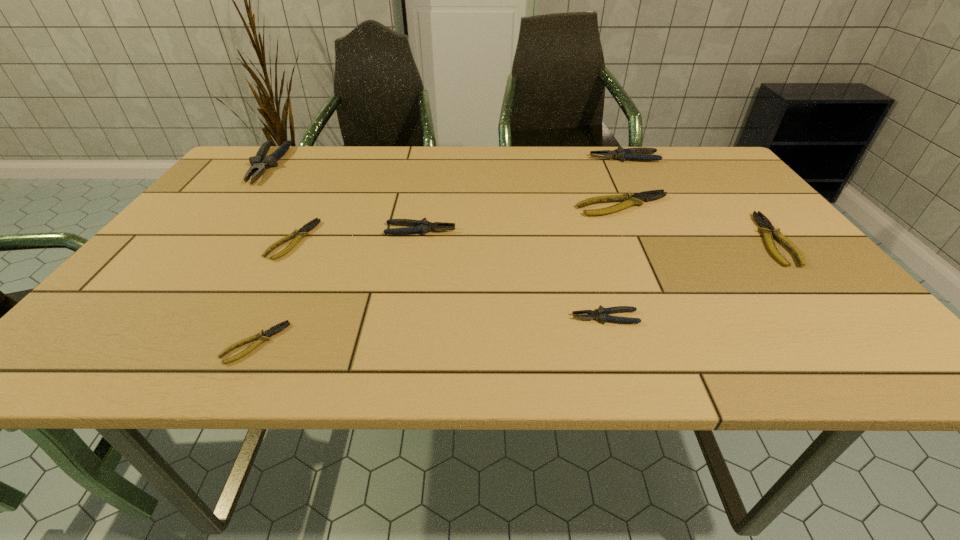
Identify the location of gray pliers that can be found as the fourth closest to the third yellow pliers from left to right. (259, 163).

This screenshot has height=540, width=960. Find the location of `gray pliers that is the third nearest to the smallest yellow pliers`. gray pliers that is the third nearest to the smallest yellow pliers is located at coordinates (259, 163).

Locate an element on the screen. This screenshot has width=960, height=540. the third closest yellow pliers relative to the third biggest yellow pliers is located at coordinates (766, 228).

Where is `the second closest yellow pliers to the third biggest yellow pliers`? The height and width of the screenshot is (540, 960). the second closest yellow pliers to the third biggest yellow pliers is located at coordinates (629, 199).

Locate an element on the screen. Image resolution: width=960 pixels, height=540 pixels. vacant space that satisfies the following two spatial constraints: 1. at the gripping part of the second tallest object; 2. on the back side of the rightmost object is located at coordinates 669,240.

Find the location of a particular element. This screenshot has height=540, width=960. free space that satisfies the following two spatial constraints: 1. at the gripping part of the biggest yellow pliers; 2. on the left side of the tallest pliers is located at coordinates (235, 206).